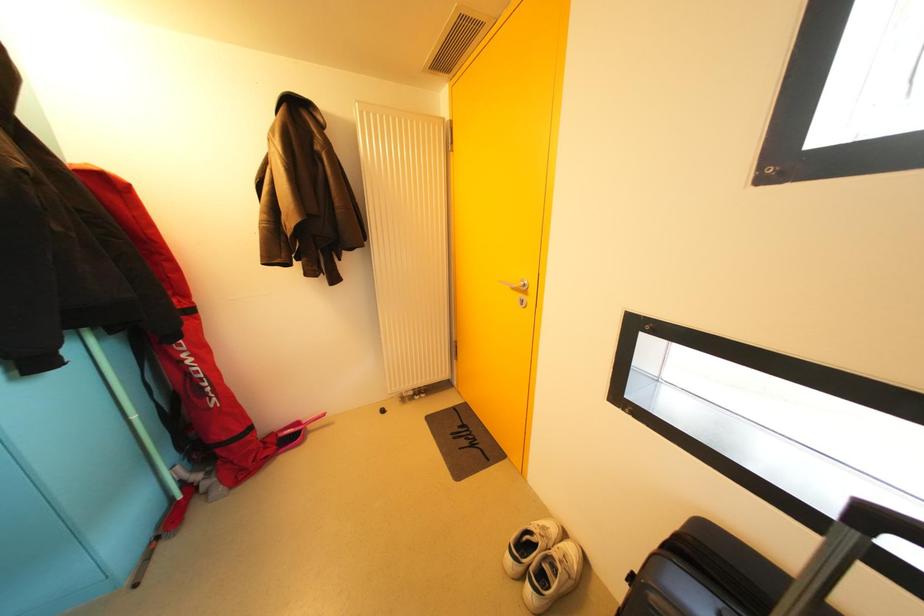
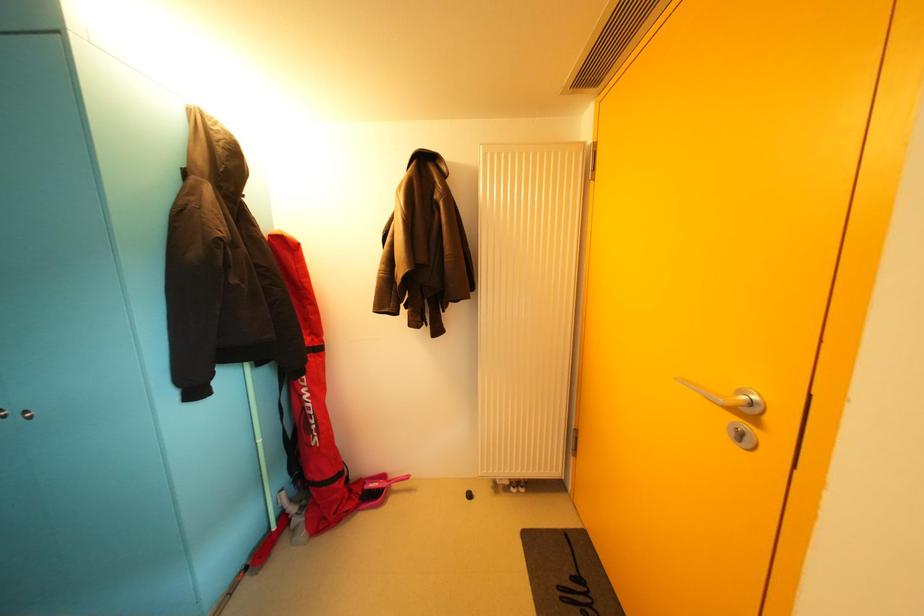
Question: In a continuous first-person perspective shot, in which direction is the camera moving?

Choices:
 (A) Left
 (B) Right
 (C) Forward
 (D) Backward

Answer: (C)